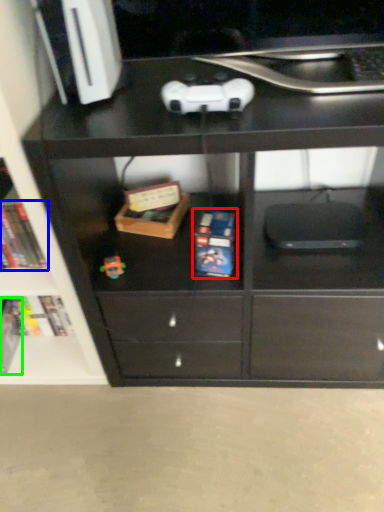
Question: Which is nearer to the paperback book (highlighted by a red box)? book (highlighted by a blue box) or paperback book (highlighted by a green box).

Choices:
 (A) book
 (B) paperback book

Answer: (A)